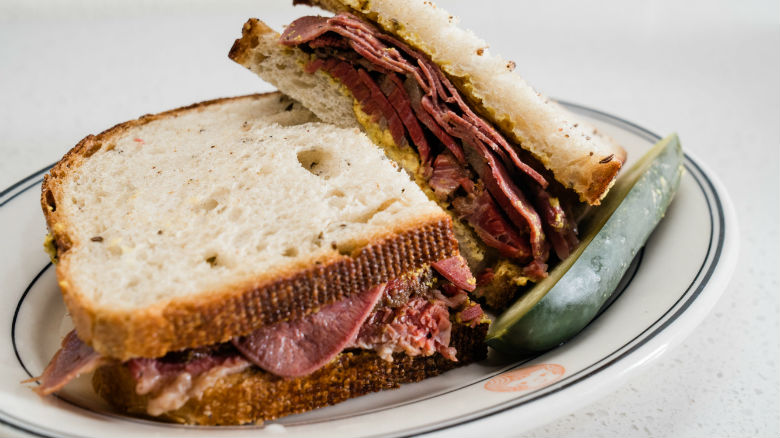
Where is `counter`? counter is located at coordinates (720, 366).